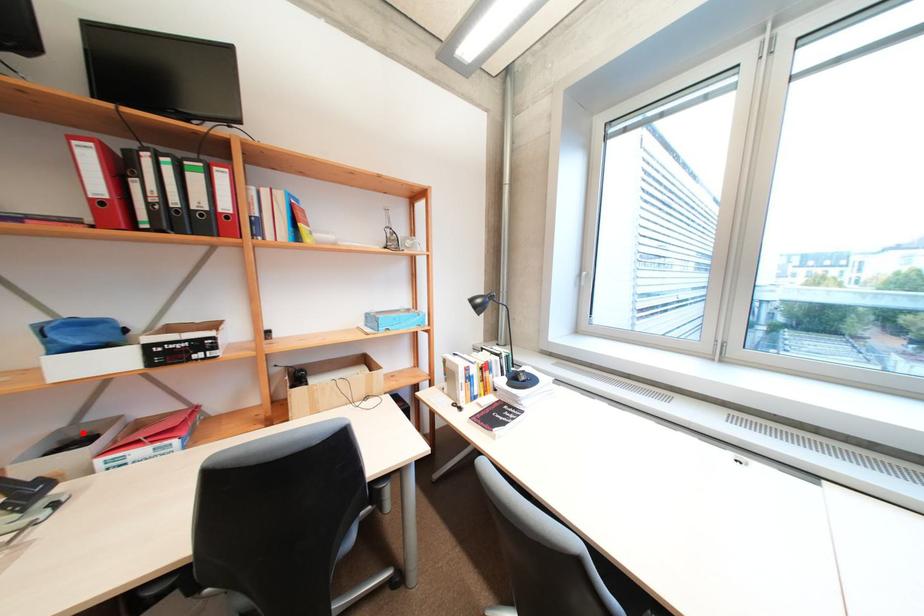
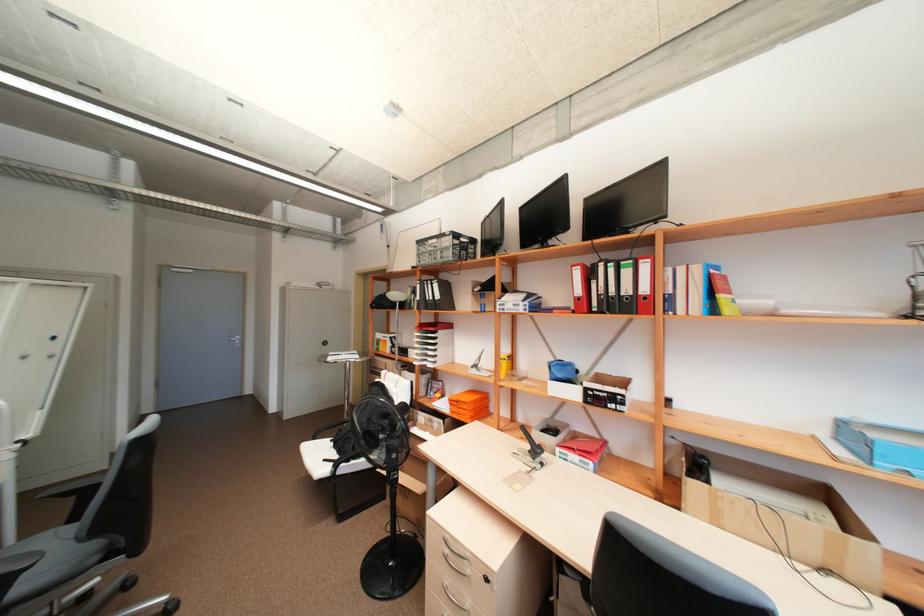
Locate, in the second image, the point that corresponds to the highlighted location in the first image.

(557, 424)